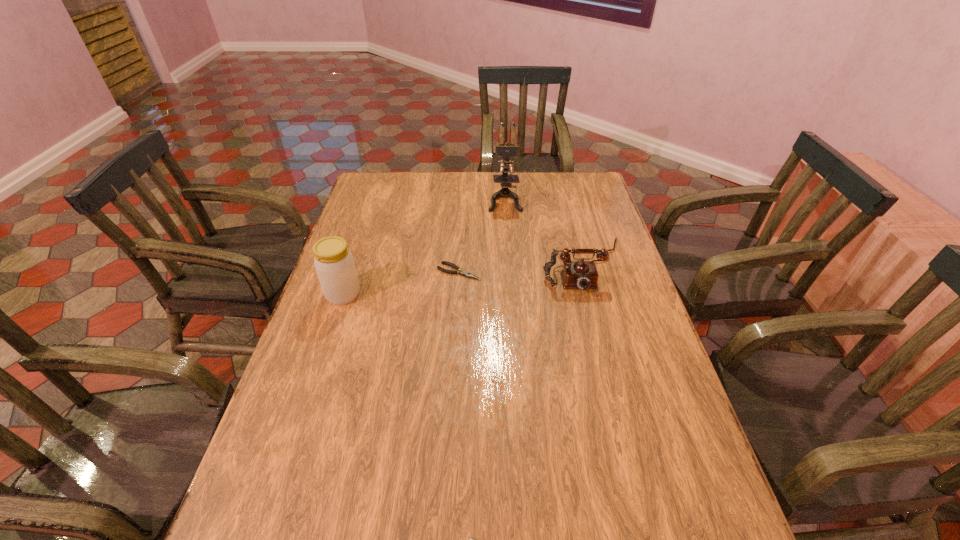
Locate an element on the screen. vacant space that's between the third shortest object and the jar is located at coordinates (464, 280).

Identify the location of blank region between the rightmost object and the tallest object. The image size is (960, 540). (544, 233).

At what (x,y) coordinates should I click in order to perform the action: click on vacant area that lies between the jar and the microscope. Please return your answer as a coordinate pair (x, y). The height and width of the screenshot is (540, 960). Looking at the image, I should click on (424, 247).

Point out which object is positioned as the third nearest to the farther pliers. Please provide its 2D coordinates. Your answer should be formatted as a tuple, i.e. [(x, y)], where the tuple contains the x and y coordinates of a point satisfying the conditions above.

[(504, 149)]

What are the coordinates of `object that is the second closest to the second tallest object` in the screenshot? It's located at (504, 149).